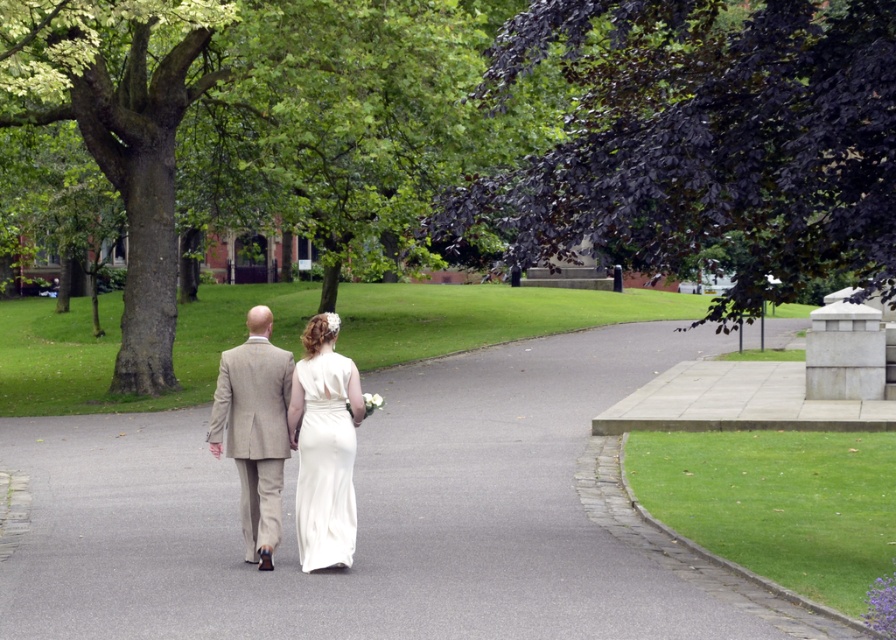
Question: Where is gray asphalt pavement at center located in relation to white satin dress at center in the image?

Choices:
 (A) above
 (B) below

Answer: (B)

Question: Estimate the real-world distances between objects in this image. Which object is closer to the gray asphalt pavement at center?

Choices:
 (A) light beige suit at center
 (B) green leafy tree at center
 (C) dark purple leafy tree at upper right

Answer: (B)

Question: Is dark purple leafy tree at upper right further to the viewer compared to light beige suit at center?

Choices:
 (A) yes
 (B) no

Answer: (B)

Question: Estimate the real-world distances between objects in this image. Which object is closer to the white satin dress at center?

Choices:
 (A) green leafy tree at center
 (B) dark purple leafy tree at upper right
 (C) gray asphalt pavement at center
 (D) light beige suit at center

Answer: (D)

Question: Which of these objects is positioned closest to the light beige suit at center?

Choices:
 (A) green leafy tree at center
 (B) white satin dress at center
 (C) dark purple leafy tree at upper right

Answer: (B)

Question: Is the position of gray asphalt pavement at center less distant than that of dark purple leafy tree at upper right?

Choices:
 (A) no
 (B) yes

Answer: (B)